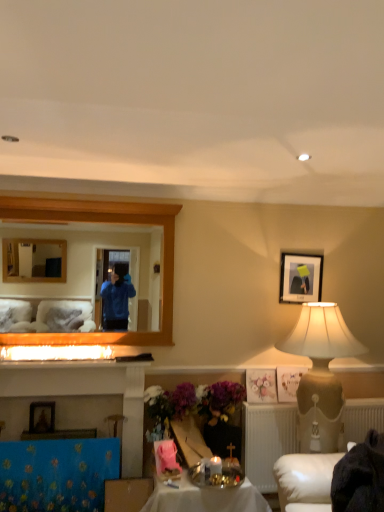
Question: Can you confirm if shiny metallic tray at center is smaller than white textured radiator at lower right?

Choices:
 (A) yes
 (B) no

Answer: (B)

Question: Does shiny metallic tray at center have a lesser width compared to white textured radiator at lower right?

Choices:
 (A) no
 (B) yes

Answer: (A)

Question: Is shiny metallic tray at center turned away from white textured radiator at lower right?

Choices:
 (A) yes
 (B) no

Answer: (B)

Question: Does shiny metallic tray at center appear on the right side of white textured radiator at lower right?

Choices:
 (A) no
 (B) yes

Answer: (A)

Question: Is shiny metallic tray at center facing towards white textured radiator at lower right?

Choices:
 (A) no
 (B) yes

Answer: (A)

Question: Is shiny metallic tray at center to the left of white textured radiator at lower right from the viewer's perspective?

Choices:
 (A) no
 (B) yes

Answer: (B)

Question: Is wooden frame mirror at upper left shorter than pastel floral print at center?

Choices:
 (A) no
 (B) yes

Answer: (A)

Question: Can you confirm if wooden frame mirror at upper left is smaller than pastel floral print at center?

Choices:
 (A) no
 (B) yes

Answer: (A)

Question: Does wooden frame mirror at upper left turn towards pastel floral print at center?

Choices:
 (A) yes
 (B) no

Answer: (B)

Question: From a real-world perspective, does wooden frame mirror at upper left stand above pastel floral print at center?

Choices:
 (A) yes
 (B) no

Answer: (A)

Question: Is wooden frame mirror at upper left to the left of pastel floral print at center from the viewer's perspective?

Choices:
 (A) no
 (B) yes

Answer: (B)

Question: Is wooden frame mirror at upper left wider than pastel floral print at center?

Choices:
 (A) no
 (B) yes

Answer: (B)

Question: Does beige textured lampshade at right lie behind pastel floral print at center?

Choices:
 (A) no
 (B) yes

Answer: (A)